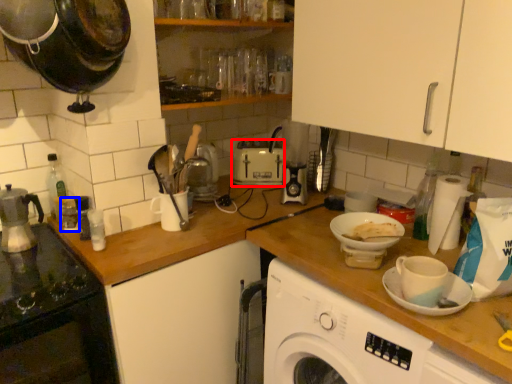
Question: Which object is further to the camera taking this photo, toaster (highlighted by a red box) or appliance (highlighted by a blue box)?

Choices:
 (A) toaster
 (B) appliance

Answer: (A)